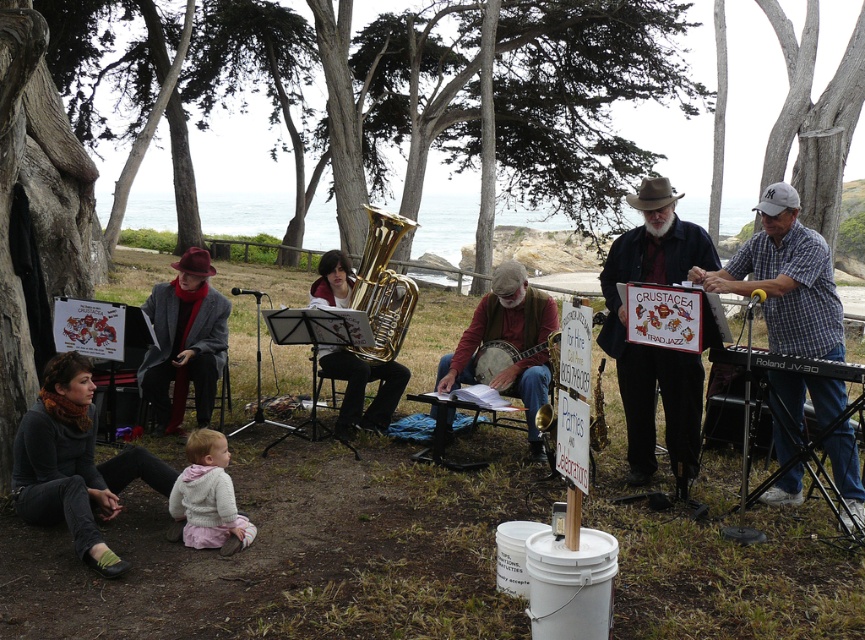
You are setting up for a small outdoor concert and need to arrange the black plastic keyboard at right and the wooden banjo at center. If you have limited space, which instrument should you place first to ensure both fit?

The black plastic keyboard at right occupies less space than the wooden banjo at center, so you should place the wooden banjo at center first to ensure there is enough space for both.

You are a photographer trying to capture a closeup of the black plastic keyboard at right without including the white checkered shirt at right in the shot. Is this possible given their positions?

The white checkered shirt at right is positioned over the black plastic keyboard at right, so it would block the view. Therefore, capturing a closeup of the black plastic keyboard at right without the white checkered shirt at right would not be possible.